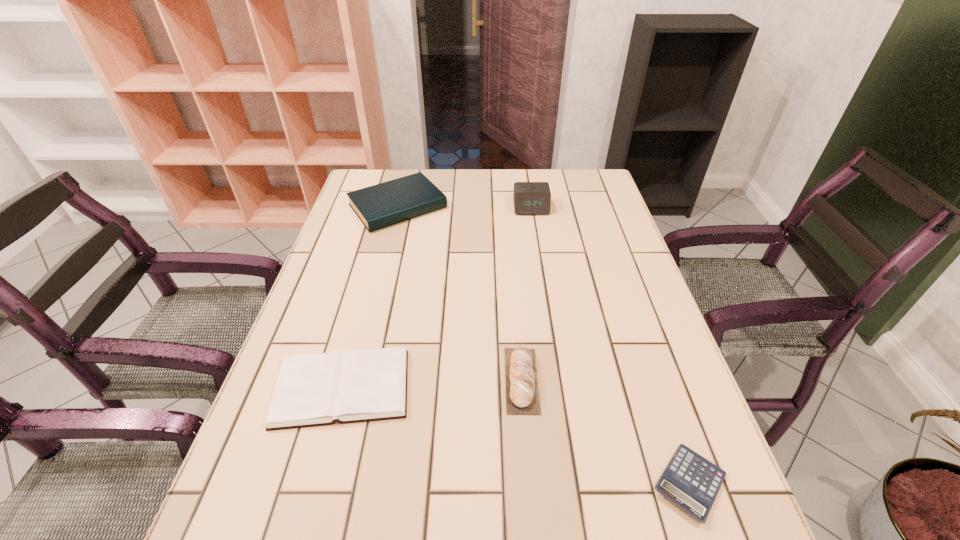
Locate an element on the screen. free space located on the back of the shorter hardback book is located at coordinates (364, 309).

Find the location of a particular element. This screenshot has height=540, width=960. vacant space positioned on the back of the calculator is located at coordinates (667, 420).

Image resolution: width=960 pixels, height=540 pixels. In order to click on alarm clock that is positioned at the far edge in this screenshot , I will do pyautogui.click(x=530, y=198).

This screenshot has height=540, width=960. In order to click on book that is at the far edge in this screenshot , I will do `click(388, 203)`.

Image resolution: width=960 pixels, height=540 pixels. What are the coordinates of `object that is positioned at the right edge` in the screenshot? It's located at click(x=690, y=481).

The height and width of the screenshot is (540, 960). I want to click on object that is at the far left corner, so click(388, 203).

This screenshot has height=540, width=960. What are the coordinates of `vacant area at the far edge of the desktop` in the screenshot? It's located at tap(492, 171).

What are the coordinates of `vacant space at the left edge of the desktop` in the screenshot? It's located at (371, 235).

The height and width of the screenshot is (540, 960). Identify the location of vacant point at the right edge. (610, 332).

The height and width of the screenshot is (540, 960). I want to click on vacant area that lies between the shortest object and the alarm clock, so click(x=611, y=346).